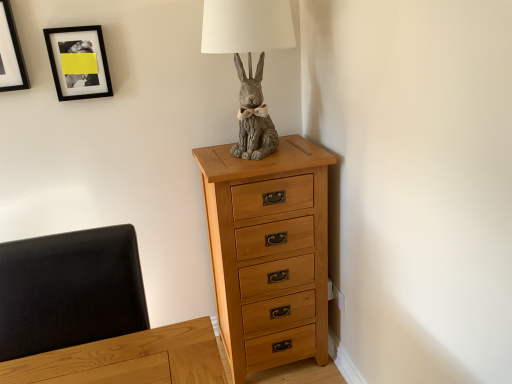
Question: Can you confirm if gray stone rabbit at center is thinner than black leather swivel chair at left?

Choices:
 (A) no
 (B) yes

Answer: (A)

Question: Is the surface of gray stone rabbit at center in direct contact with black leather swivel chair at left?

Choices:
 (A) no
 (B) yes

Answer: (A)

Question: Can you confirm if gray stone rabbit at center is wider than black leather swivel chair at left?

Choices:
 (A) yes
 (B) no

Answer: (A)

Question: Does gray stone rabbit at center lie in front of black leather swivel chair at left?

Choices:
 (A) no
 (B) yes

Answer: (A)

Question: Is gray stone rabbit at center taller than black leather swivel chair at left?

Choices:
 (A) no
 (B) yes

Answer: (B)

Question: Based on their positions, is black matte picture frame at upper left, which is counted as the second picture frame, starting from the left, located to the left or right of gray stone rabbit at center?

Choices:
 (A) left
 (B) right

Answer: (A)

Question: From the image's perspective, is black matte picture frame at upper left, which is counted as the second picture frame, starting from the left, located above or below gray stone rabbit at center?

Choices:
 (A) below
 (B) above

Answer: (B)

Question: Does point (79, 28) appear closer or farther from the camera than point (266, 23)?

Choices:
 (A) farther
 (B) closer

Answer: (A)

Question: In terms of width, does black matte picture frame at upper left, the 1th picture frame from the right, look wider or thinner when compared to gray stone rabbit at center?

Choices:
 (A) wide
 (B) thin

Answer: (B)

Question: In the image, is natural wood chest of drawers at center positioned in front of or behind black matte picture frame at upper left, which is counted as the second picture frame, starting from the left?

Choices:
 (A) front
 (B) behind

Answer: (A)

Question: Looking at their shapes, would you say natural wood chest of drawers at center is wider or thinner than black matte picture frame at upper left, the 1th picture frame from the right?

Choices:
 (A) thin
 (B) wide

Answer: (B)

Question: From the image's perspective, is natural wood chest of drawers at center positioned above or below black matte picture frame at upper left, the 1th picture frame from the right?

Choices:
 (A) above
 (B) below

Answer: (B)

Question: From a real-world perspective, is natural wood chest of drawers at center positioned above or below black matte picture frame at upper left, the 1th picture frame from the right?

Choices:
 (A) above
 (B) below

Answer: (B)

Question: Is point (24, 261) closer or farther from the camera than point (268, 125)?

Choices:
 (A) closer
 (B) farther

Answer: (A)

Question: In terms of size, does black leather swivel chair at left appear bigger or smaller than gray stone rabbit at center?

Choices:
 (A) small
 (B) big

Answer: (A)